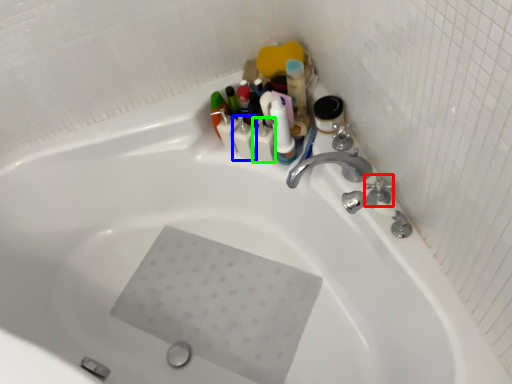
Question: Which object is the farthest from plumbing fixture (highlighted by a red box)? Choose among these: toiletry (highlighted by a blue box) or toiletry (highlighted by a green box).

Choices:
 (A) toiletry
 (B) toiletry

Answer: (A)